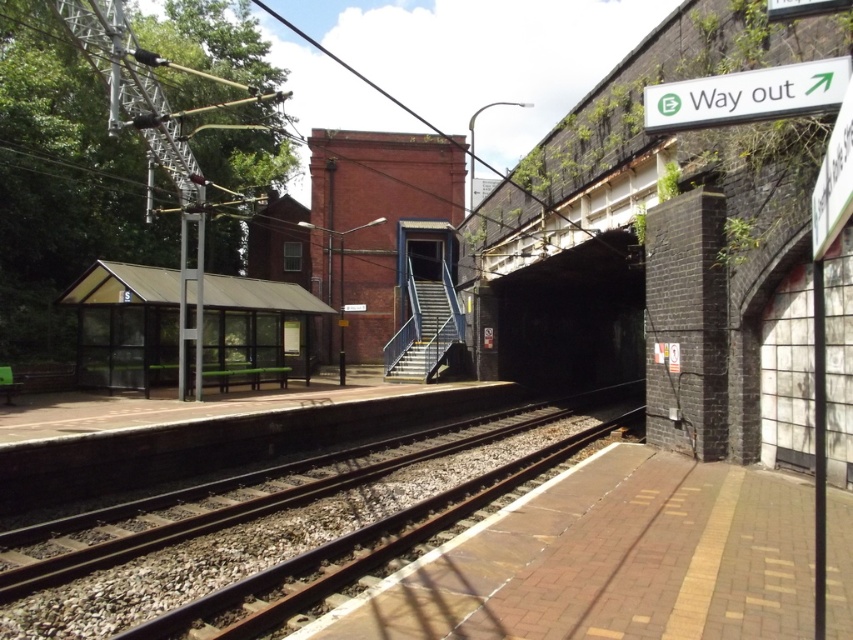
Question: Which point is closer to the camera?

Choices:
 (A) (187, 292)
 (B) (61, 580)

Answer: (B)

Question: Does brown metal train track at center have a larger size compared to transparent plastic bus stop at left?

Choices:
 (A) yes
 (B) no

Answer: (B)

Question: Can you confirm if brown metal train track at center is positioned to the right of transparent plastic bus stop at left?

Choices:
 (A) no
 (B) yes

Answer: (B)

Question: Where is brown metal train track at center located in relation to transparent plastic bus stop at left in the image?

Choices:
 (A) right
 (B) left

Answer: (A)

Question: Which point is farther from the camera taking this photo?

Choices:
 (A) (96, 262)
 (B) (244, 524)

Answer: (A)